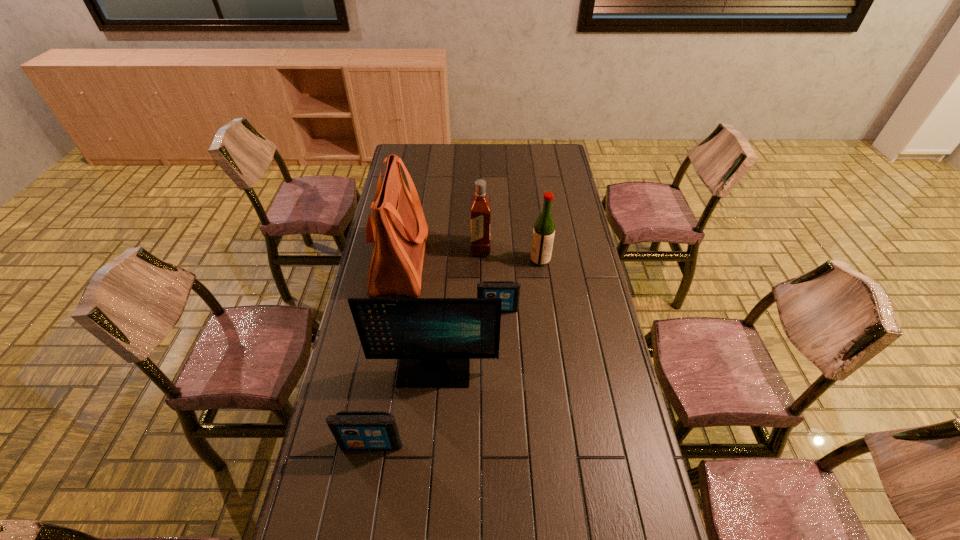
You are a GUI agent. You are given a task and a screenshot of the screen. Output one action in this format:
    pyautogui.click(x=<x>, y=<y>)
    Task: Click on the nearer iPod
    
    Given the screenshot: What is the action you would take?
    pyautogui.click(x=353, y=430)

Find the location of a particular element. Image resolution: width=960 pixels, height=540 pixels. the taller iPod is located at coordinates (353, 430).

What are the coordinates of `the shortest object` in the screenshot? It's located at (509, 291).

Locate an element on the screen. This screenshot has height=540, width=960. the farther iPod is located at coordinates (509, 291).

Identify the location of the rightmost object. (544, 228).

Image resolution: width=960 pixels, height=540 pixels. I want to click on the left liquor, so click(480, 245).

The width and height of the screenshot is (960, 540). I want to click on shopping bag, so click(398, 228).

The height and width of the screenshot is (540, 960). Identify the location of monitor. click(x=434, y=339).

The height and width of the screenshot is (540, 960). Identify the location of vacant space located on the front screen of the left iPod. (362, 500).

Where is `vacant region located 0.120m on the front screen of the right iPod`? This screenshot has width=960, height=540. vacant region located 0.120m on the front screen of the right iPod is located at coordinates (499, 340).